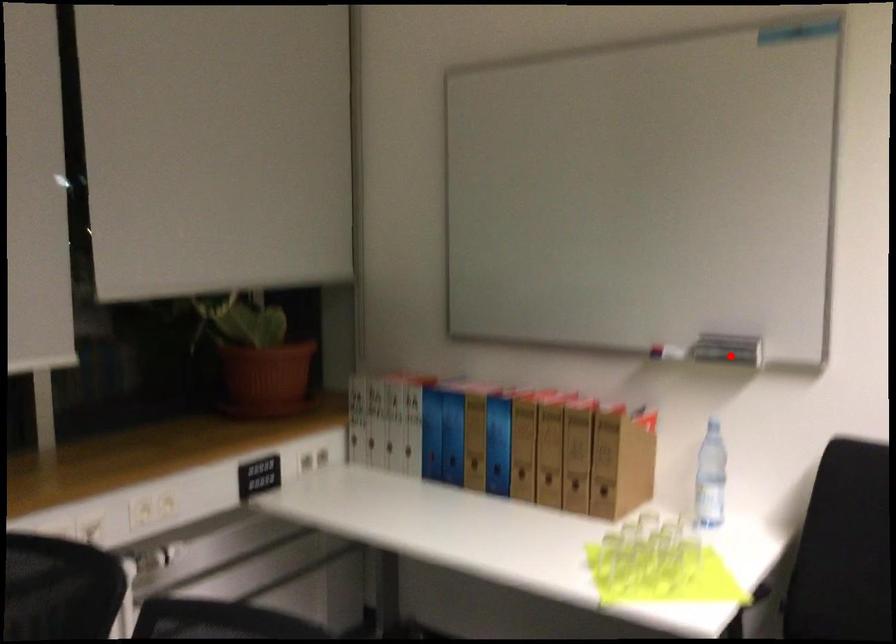
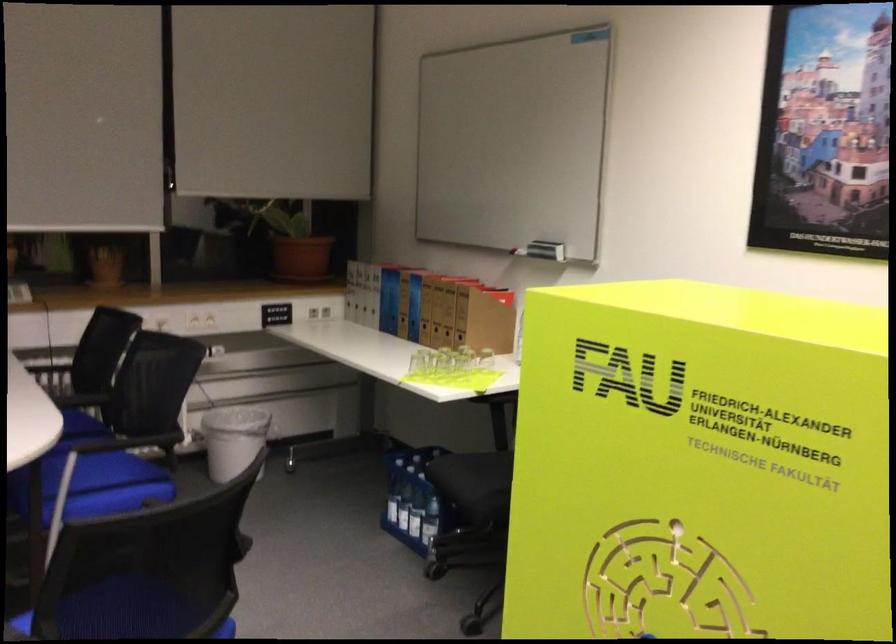
Locate, in the second image, the point that corresponds to the highlighted location in the first image.

(546, 250)